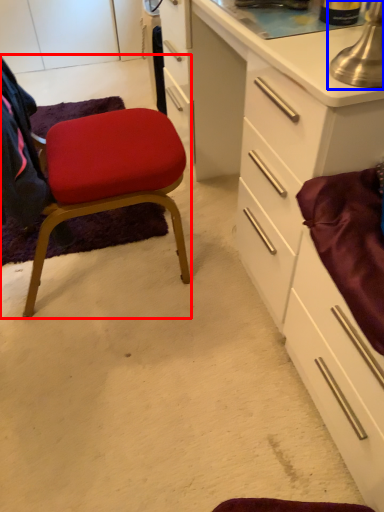
Question: Among these objects, which one is nearest to the camera, chair (highlighted by a red box) or table lamp (highlighted by a blue box)?

Choices:
 (A) chair
 (B) table lamp

Answer: (B)